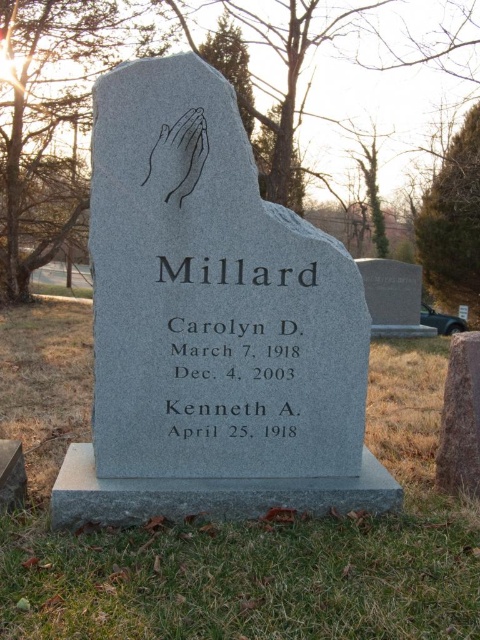
Question: Is gray granite gravestone at lower right further to camera compared to black matte hands at center?

Choices:
 (A) yes
 (B) no

Answer: (A)

Question: Where is gray granite gravestone at lower right located in relation to black matte hands at center in the image?

Choices:
 (A) right
 (B) left

Answer: (A)

Question: Which point appears farthest from the camera in this image?

Choices:
 (A) (192, 209)
 (B) (459, 472)

Answer: (B)

Question: Which point is farther to the camera?

Choices:
 (A) black matte hands at center
 (B) gray granite monument at center
 (C) gray granite gravestone at lower right

Answer: (C)

Question: Which of the following is the farthest from the observer?

Choices:
 (A) (148, 157)
 (B) (162, 490)

Answer: (B)

Question: Does gray granite monument at center have a smaller size compared to gray granite gravestone at lower right?

Choices:
 (A) yes
 (B) no

Answer: (B)